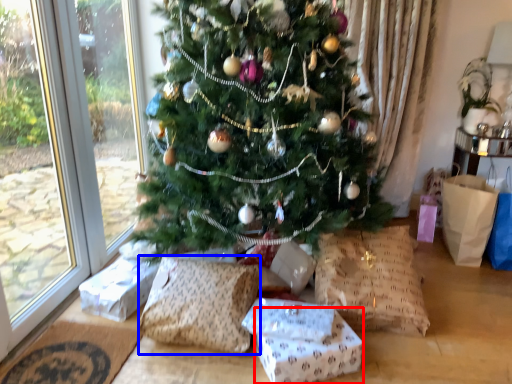
Question: Among these objects, which one is nearest to the camera, gift box (highlighted by a red box) or pillow (highlighted by a blue box)?

Choices:
 (A) gift box
 (B) pillow

Answer: (A)